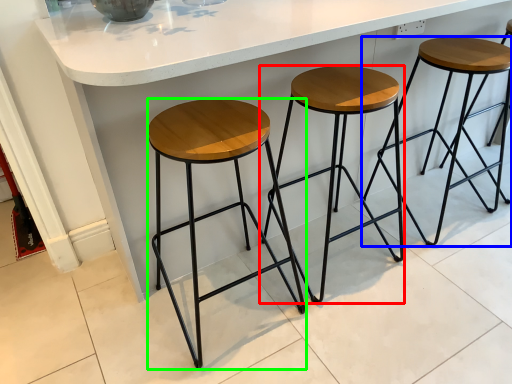
Question: Considering the real-world distances, which object is farthest from stool (highlighted by a red box)? stool (highlighted by a blue box) or stool (highlighted by a green box)?

Choices:
 (A) stool
 (B) stool

Answer: (A)